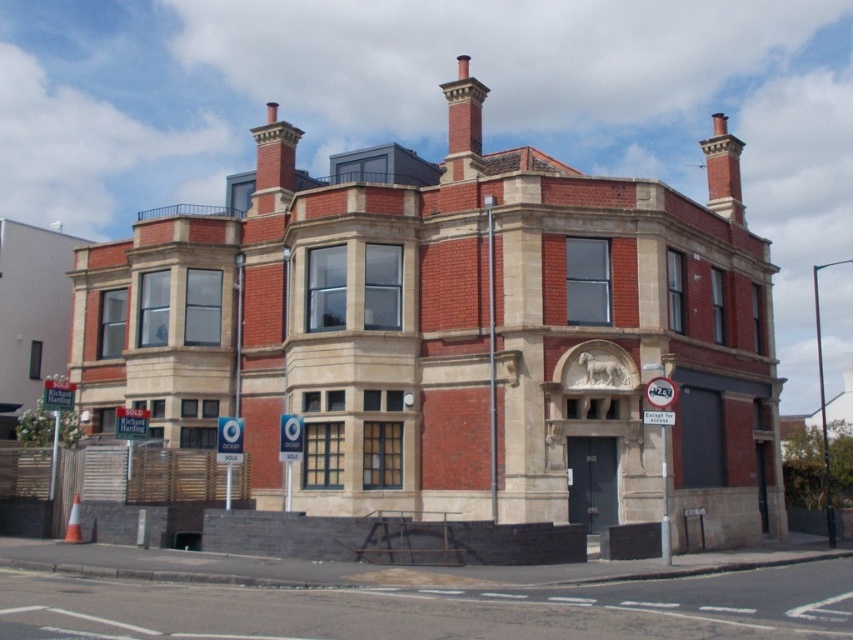
Question: Which of the following is the farthest from the observer?

Choices:
 (A) asphalt at lower center
 (B) red brick chimney at upper center

Answer: (B)

Question: Which point is farther to the camera?

Choices:
 (A) red brick chimney at upper center
 (B) asphalt at lower center

Answer: (A)

Question: Is red brick chimney at upper center thinner than asphalt at lower center?

Choices:
 (A) yes
 (B) no

Answer: (B)

Question: Which point is closer to the camera?

Choices:
 (A) asphalt at lower center
 (B) red brick chimney at upper center

Answer: (A)

Question: Can you confirm if red brick chimney at upper center is positioned above asphalt at lower center?

Choices:
 (A) yes
 (B) no

Answer: (A)

Question: Considering the relative positions of red brick chimney at upper center and asphalt at lower center in the image provided, where is red brick chimney at upper center located with respect to asphalt at lower center?

Choices:
 (A) above
 (B) below

Answer: (A)